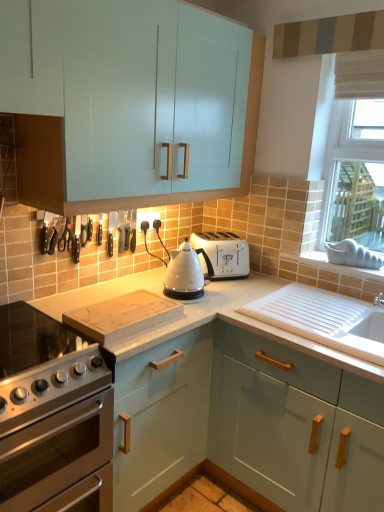
Locate an element on the screen. Image resolution: width=384 pixels, height=512 pixels. blank space above wooden cutting board at center (from a real-world perspective) is located at coordinates 127,311.